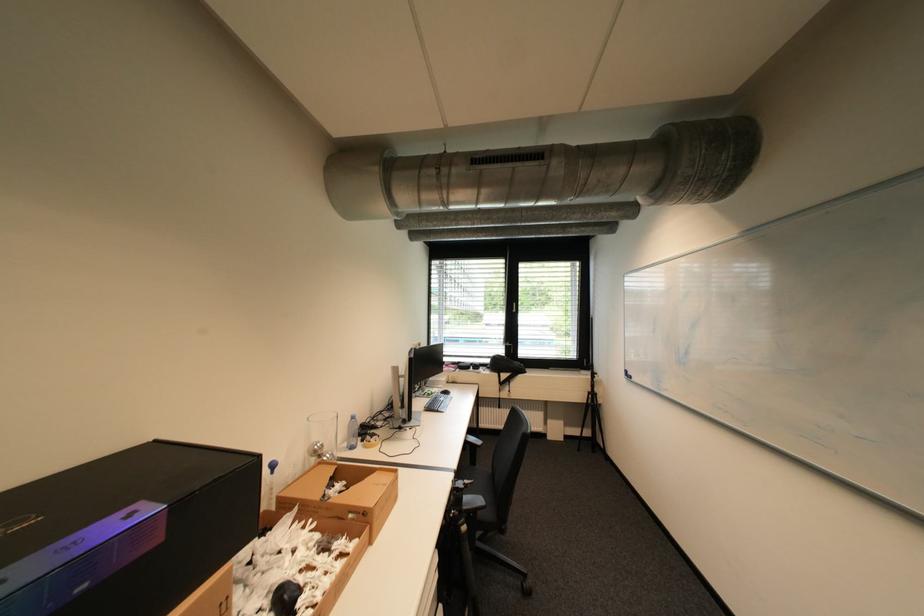
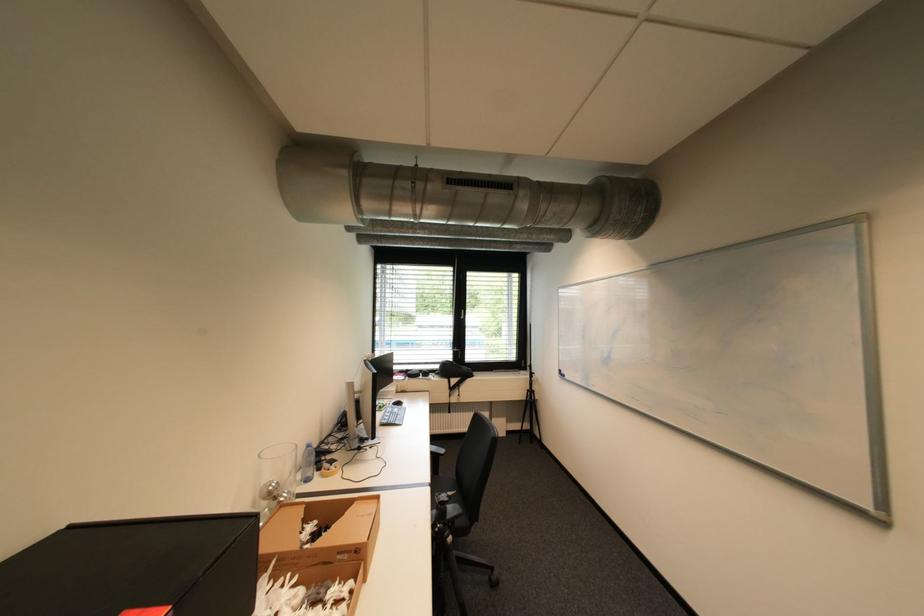
Find the pixel in the second image that matches [523,304] in the first image.

(470, 312)